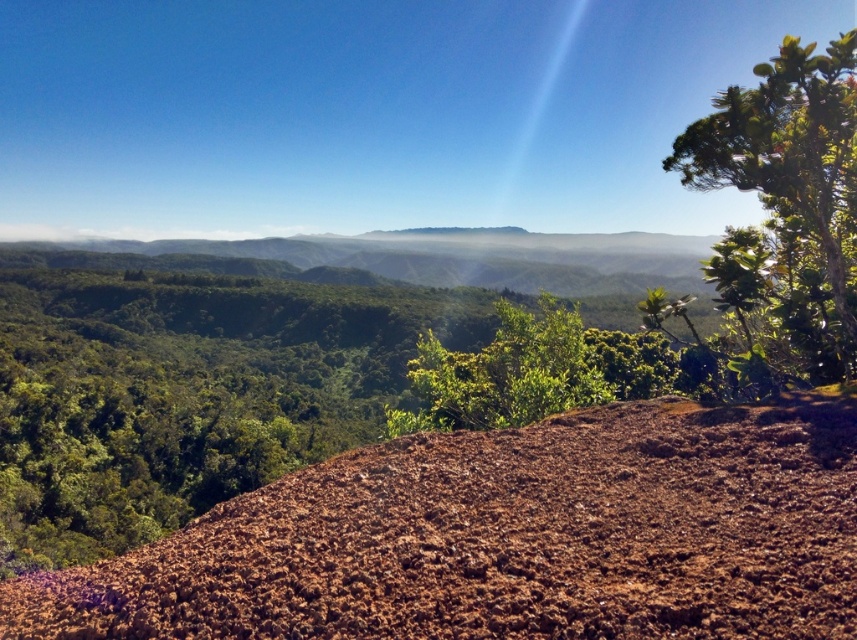
You are a photographer standing at the edge of the landscape. You want to take a photo that includes both the reddish brown textured surface in the foreground and the distant hills. Which of the two points, point (802, 104) or point (520, 403), should you focus on to ensure both elements are in sharp focus?

You should focus on point (520, 403) because it is farther away from the camera than point (802, 104). By focusing on the farther point, the depth of field will include both the foreground and background elements more effectively.

You are an environmental scientist studying the landscape. You observe the green leafy tree at upper right and the green leafy bush at center. Which of these two plants is positioned closer to your viewpoint?

The green leafy tree at upper right is closer to the viewer than the green leafy bush at center.